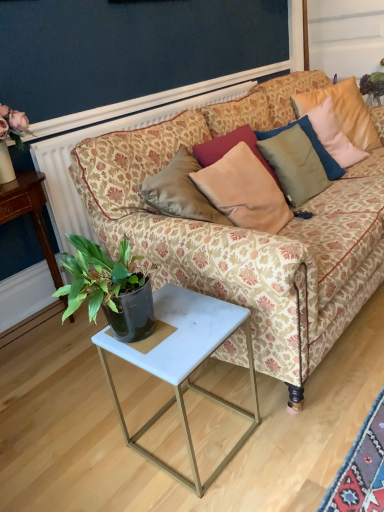
Question: Can we say dark blue wall at upper center lies outside patterned fabric couch at center?

Choices:
 (A) no
 (B) yes

Answer: (B)

Question: Does dark blue wall at upper center have a smaller size compared to patterned fabric couch at center?

Choices:
 (A) no
 (B) yes

Answer: (B)

Question: Is patterned fabric couch at center at the back of dark blue wall at upper center?

Choices:
 (A) no
 (B) yes

Answer: (A)

Question: Does dark blue wall at upper center have a greater height compared to patterned fabric couch at center?

Choices:
 (A) yes
 (B) no

Answer: (B)

Question: Considering the relative sizes of dark blue wall at upper center and patterned fabric couch at center in the image provided, is dark blue wall at upper center wider than patterned fabric couch at center?

Choices:
 (A) no
 (B) yes

Answer: (A)

Question: Considering the positions of white marble table at lower left and dark blue wall at upper center in the image, is white marble table at lower left wider or thinner than dark blue wall at upper center?

Choices:
 (A) thin
 (B) wide

Answer: (B)

Question: Does point (26, 211) appear closer or farther from the camera than point (71, 121)?

Choices:
 (A) farther
 (B) closer

Answer: (B)

Question: Is white marble table at lower left spatially inside dark blue wall at upper center, or outside of it?

Choices:
 (A) outside
 (B) inside

Answer: (A)

Question: From a real-world perspective, is white marble table at lower left physically located above or below dark blue wall at upper center?

Choices:
 (A) below
 (B) above

Answer: (A)

Question: In the image, is satin beige pillow at center, the 3th pillow viewed from the right, positioned in front of or behind green leafy plant at upper right?

Choices:
 (A) front
 (B) behind

Answer: (A)

Question: Is satin beige pillow at center, the 3th pillow viewed from the right, bigger or smaller than green leafy plant at upper right?

Choices:
 (A) small
 (B) big

Answer: (B)

Question: From a real-world perspective, is satin beige pillow at center, the 3th pillow viewed from the right, above or below green leafy plant at upper right?

Choices:
 (A) above
 (B) below

Answer: (B)

Question: Is satin beige pillow at center, the 1th pillow in the left-to-right sequence, taller or shorter than green leafy plant at upper right?

Choices:
 (A) tall
 (B) short

Answer: (A)

Question: From the image's perspective, is velvet beige pillow at upper right, placed as the first pillow when sorted from right to left, located above or below white marble side table at lower center?

Choices:
 (A) above
 (B) below

Answer: (A)

Question: In terms of size, does velvet beige pillow at upper right, arranged as the third pillow when viewed from the left, appear bigger or smaller than white marble side table at lower center?

Choices:
 (A) small
 (B) big

Answer: (A)